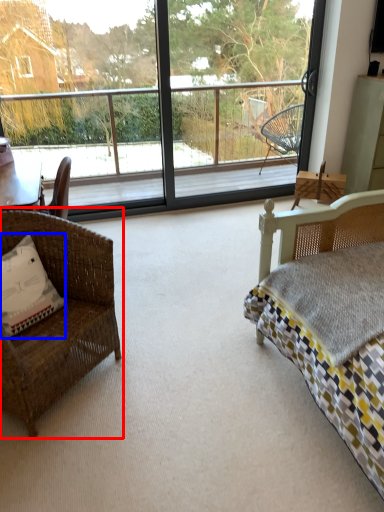
Question: Which object appears farthest to the camera in this image, chair (highlighted by a red box) or pillow (highlighted by a blue box)?

Choices:
 (A) chair
 (B) pillow

Answer: (B)